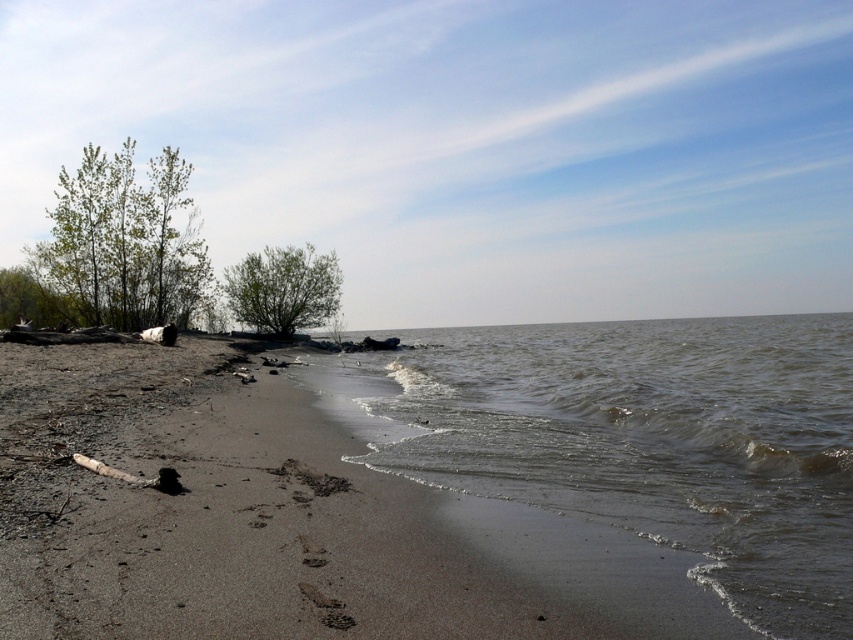
Question: Considering the real-world distances, which object is closest to the green leafy trees at upper left?

Choices:
 (A) brown murky water at lower left
 (B) green matte tree at center

Answer: (B)

Question: Can you confirm if brown murky water at lower left is positioned to the right of green leafy trees at upper left?

Choices:
 (A) yes
 (B) no

Answer: (A)

Question: Which object is the farthest from the green leafy trees at upper left?

Choices:
 (A) green matte tree at center
 (B) brown murky water at lower left

Answer: (B)

Question: Which of the following is the closest to the observer?

Choices:
 (A) green leafy trees at upper left
 (B) green matte tree at center

Answer: (A)

Question: Does brown murky water at lower left have a larger size compared to green leafy trees at upper left?

Choices:
 (A) no
 (B) yes

Answer: (A)

Question: Does brown murky water at lower left have a smaller size compared to green leafy trees at upper left?

Choices:
 (A) no
 (B) yes

Answer: (B)